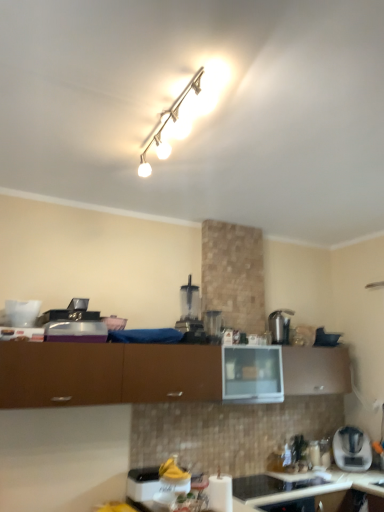
Question: Is clear plastic blender at center, positioned as the 3th appliance in front-to-back order, taller or shorter than satin silver kettle at upper right, which is the third appliance in bottom-to-top order?

Choices:
 (A) tall
 (B) short

Answer: (B)

Question: Which is correct: clear plastic blender at center, positioned as the fourth appliance in bottom-to-top order, is inside satin silver kettle at upper right, which is the 2th appliance in top-to-bottom order, or outside of it?

Choices:
 (A) outside
 (B) inside

Answer: (A)

Question: Which object is the farthest from the satin silver kettle at upper right, which is the third appliance in bottom-to-top order?

Choices:
 (A) white glossy track light at upper center
 (B) white paper towel holder at lower center, which is the fourth appliance in back-to-front order
 (C) brown matte cabinet at center
 (D) clear plastic blender at center, positioned as the 3th appliance in front-to-back order
 (E) white glossy paper towel holder at lower center, the third appliance when ordered from back to front

Answer: (A)

Question: Considering the real-world distances, which object is farthest from the white glossy track light at upper center?

Choices:
 (A) clear plastic blender at center, which appears as the 2th appliance when viewed from the back
 (B) brown matte cabinet at center
 (C) satin silver kettle at upper right, which appears as the 1th appliance when viewed from the back
 (D) white plastic toaster at lower right
 (E) white glossy paper towel holder at lower center, arranged as the 2th appliance when viewed from the front

Answer: (D)